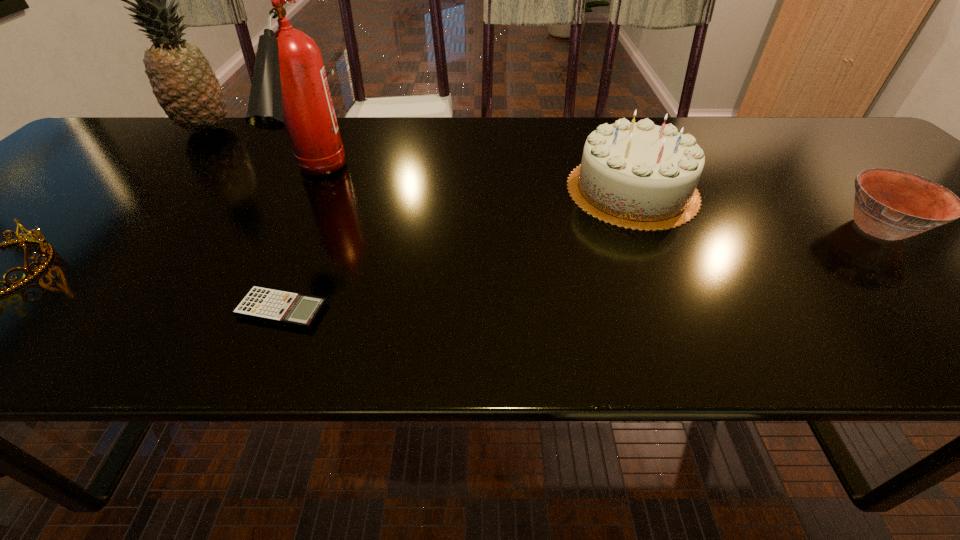
At what (x,y) coordinates should I click in order to perform the action: click on the farthest object. Please return your answer as a coordinate pair (x, y). Looking at the image, I should click on (187, 89).

The height and width of the screenshot is (540, 960). I want to click on fire extinguisher, so click(x=289, y=88).

In order to click on the fourth shortest object in this screenshot , I will do pos(640,176).

The width and height of the screenshot is (960, 540). Identify the location of birthday cake. (640, 176).

Locate an element on the screen. This screenshot has height=540, width=960. bowl is located at coordinates (890, 204).

I want to click on the rightmost object, so click(x=890, y=204).

Image resolution: width=960 pixels, height=540 pixels. What are the coordinates of `calculator` in the screenshot? It's located at (281, 307).

The height and width of the screenshot is (540, 960). What are the coordinates of `free space located 0.400m on the front of the pineapple` in the screenshot? It's located at (102, 241).

You are a GUI agent. You are given a task and a screenshot of the screen. Output one action in this format:
    pyautogui.click(x=<x>, y=<y>)
    Task: Click on the free point located at the nozzle end of the fire extinguisher
    The image size is (960, 540).
    Given the screenshot: What is the action you would take?
    pyautogui.click(x=285, y=246)

Identify the location of vacant space located on the front of the birthday cake. This screenshot has height=540, width=960. (657, 247).